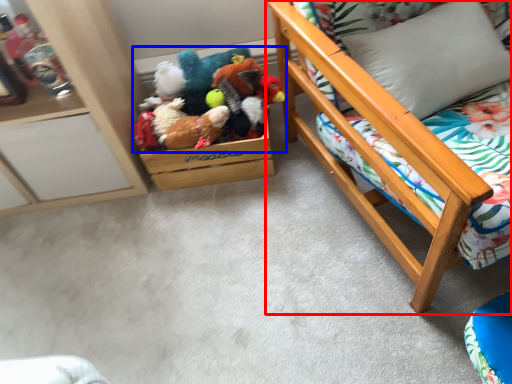
Question: Which object appears closest to the camera in this image, furniture (highlighted by a red box) or toy (highlighted by a blue box)?

Choices:
 (A) furniture
 (B) toy

Answer: (A)